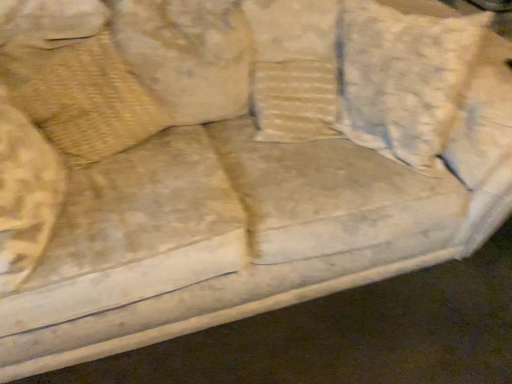
Question: Which direction should I rotate to look at washed cotton pillow at center, the second pillow positioned from the left?

Choices:
 (A) left
 (B) right

Answer: (B)

Question: Is beige textured pillow at upper left, the second pillow in the right-to-left sequence, next to washed cotton pillow at center, which appears as the first pillow when viewed from the right?

Choices:
 (A) no
 (B) yes

Answer: (A)

Question: Would you say beige textured pillow at upper left, which is the first pillow in left-to-right order, contains washed cotton pillow at center, the second pillow positioned from the left?

Choices:
 (A) yes
 (B) no

Answer: (B)

Question: From the image's perspective, is beige textured pillow at upper left, which is the first pillow in left-to-right order, under washed cotton pillow at center, the second pillow positioned from the left?

Choices:
 (A) no
 (B) yes

Answer: (B)

Question: Would you say beige textured pillow at upper left, the second pillow in the right-to-left sequence, is outside washed cotton pillow at center, the second pillow positioned from the left?

Choices:
 (A) yes
 (B) no

Answer: (A)

Question: Can you confirm if beige textured pillow at upper left, the second pillow in the right-to-left sequence, is positioned to the left of washed cotton pillow at center, the second pillow positioned from the left?

Choices:
 (A) yes
 (B) no

Answer: (A)

Question: Can you confirm if beige textured pillow at upper left, the second pillow in the right-to-left sequence, is shorter than washed cotton pillow at center, the second pillow positioned from the left?

Choices:
 (A) yes
 (B) no

Answer: (A)

Question: Can you confirm if washed cotton pillow at center, which appears as the first pillow when viewed from the right, is positioned to the left of beige textured pillow at upper left, the second pillow in the right-to-left sequence?

Choices:
 (A) no
 (B) yes

Answer: (A)

Question: Are washed cotton pillow at center, which appears as the first pillow when viewed from the right, and beige textured pillow at upper left, which is the first pillow in left-to-right order, beside each other?

Choices:
 (A) yes
 (B) no

Answer: (B)

Question: From a real-world perspective, is washed cotton pillow at center, which appears as the first pillow when viewed from the right, positioned under beige textured pillow at upper left, which is the first pillow in left-to-right order, based on gravity?

Choices:
 (A) yes
 (B) no

Answer: (B)

Question: Does washed cotton pillow at center, the second pillow positioned from the left, contain beige textured pillow at upper left, which is the first pillow in left-to-right order?

Choices:
 (A) no
 (B) yes

Answer: (A)

Question: Does washed cotton pillow at center, the second pillow positioned from the left, have a lesser height compared to beige textured pillow at upper left, the second pillow in the right-to-left sequence?

Choices:
 (A) yes
 (B) no

Answer: (B)

Question: Can you confirm if washed cotton pillow at center, which appears as the first pillow when viewed from the right, is thinner than beige textured pillow at upper left, the second pillow in the right-to-left sequence?

Choices:
 (A) no
 (B) yes

Answer: (A)

Question: Is point (436, 44) closer or farther from the camera than point (86, 110)?

Choices:
 (A) farther
 (B) closer

Answer: (B)